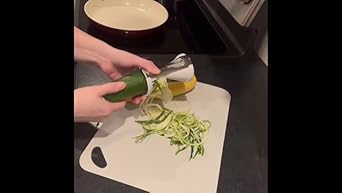
Where is `stovetop`? This screenshot has width=342, height=193. stovetop is located at coordinates (200, 31).